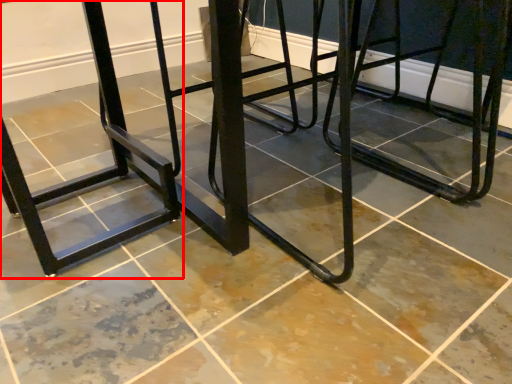
Question: From the image's perspective, considering the relative positions of bar stool (annotated by the red box) and furniture in the image provided, where is bar stool (annotated by the red box) located with respect to the staircase?

Choices:
 (A) below
 (B) above

Answer: (A)